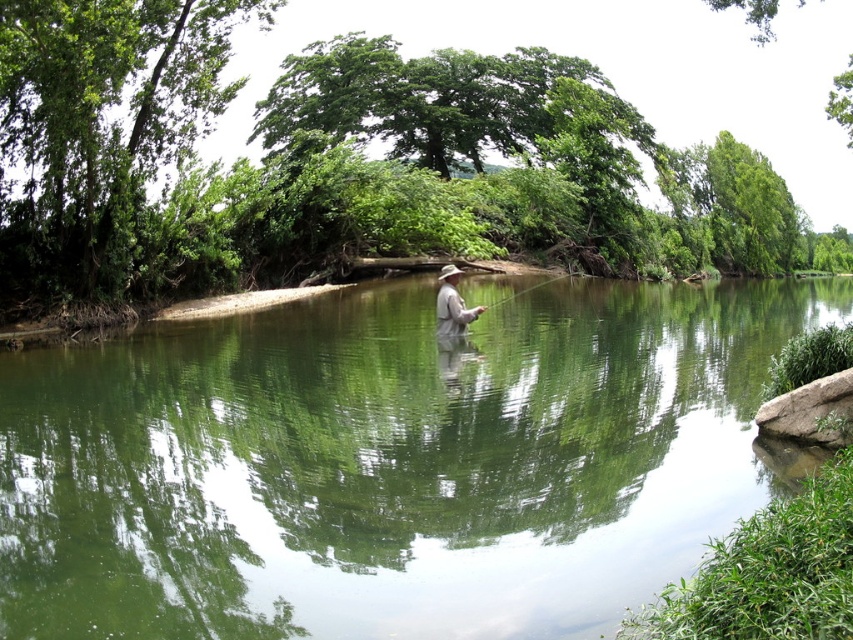
Question: Which point appears farthest from the camera in this image?

Choices:
 (A) (643, 346)
 (B) (434, 310)

Answer: (B)

Question: In this image, where is green smooth water at center located relative to matte brown hat at center?

Choices:
 (A) below
 (B) above

Answer: (A)

Question: Which point appears farthest from the camera in this image?

Choices:
 (A) (318, 545)
 (B) (451, 291)

Answer: (B)

Question: From the image, what is the correct spatial relationship of green smooth water at center in relation to matte brown hat at center?

Choices:
 (A) above
 (B) below

Answer: (B)

Question: Observing the image, what is the correct spatial positioning of green smooth water at center in reference to matte brown hat at center?

Choices:
 (A) above
 (B) below

Answer: (B)